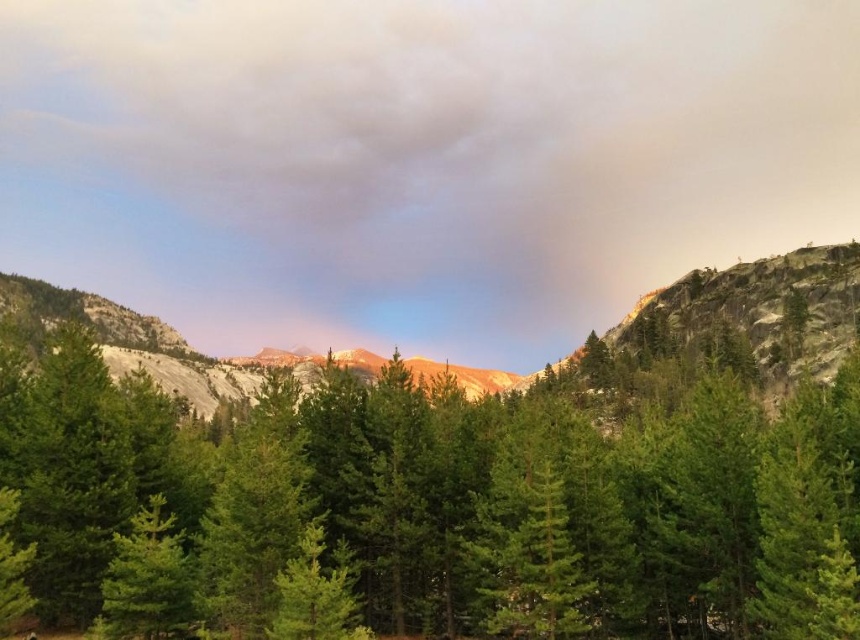
Is point (735, 38) farther from viewer compared to point (682, 420)?

Yes, point (735, 38) is behind point (682, 420).

Can you confirm if smokey gray cloud at upper center is positioned above green matte tree at center?

Yes, smokey gray cloud at upper center is above green matte tree at center.

Is point (747, 42) behind point (287, 438)?

Yes, point (747, 42) is behind point (287, 438).

This screenshot has height=640, width=860. What are the coordinates of `smokey gray cloud at upper center` in the screenshot? It's located at (416, 157).

Which is in front, point (624, 630) or point (502, 376)?

Point (624, 630) is in front.

Who is taller, green matte tree at center or rugged granite mountain at center?

rugged granite mountain at center is taller.

Is point (845, 499) farther from viewer compared to point (808, 275)?

That is False.

In order to click on green matte tree at center in this screenshot , I will do `click(439, 506)`.

Consider the image. Does smokey gray cloud at upper center come in front of rugged granite mountain at center?

No.

Does smokey gray cloud at upper center have a lesser width compared to rugged granite mountain at center?

Incorrect, smokey gray cloud at upper center's width is not less than rugged granite mountain at center's.

In order to click on smokey gray cloud at upper center in this screenshot , I will do `click(416, 157)`.